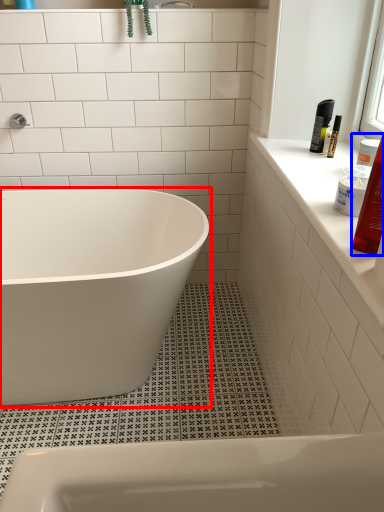
Question: Which object appears closest to the camera in this image, bathtub (highlighted by a red box) or toiletry (highlighted by a blue box)?

Choices:
 (A) bathtub
 (B) toiletry

Answer: (B)